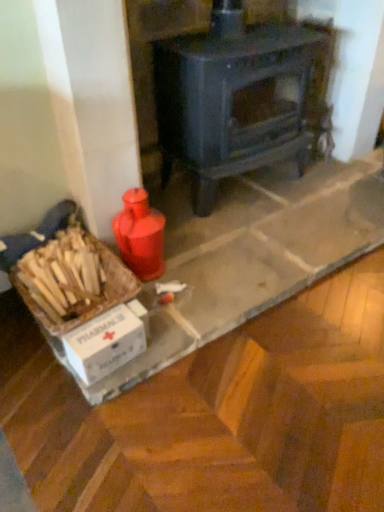
The width and height of the screenshot is (384, 512). I want to click on white cardboard box at lower left, so click(105, 343).

Identify the location of white cardboard box at lower left. The height and width of the screenshot is (512, 384). point(83,301).

Locate an element on the screen. matte black wood burning stove at center is located at coordinates [232, 98].

Where is `white cardboard box at lower left`? The height and width of the screenshot is (512, 384). white cardboard box at lower left is located at coordinates (105, 343).

Can you see white cardboard box at lower left touching matte black wood burning stove at center?

No, white cardboard box at lower left is not touching matte black wood burning stove at center.

From the image's perspective, relative to matte black wood burning stove at center, is white cardboard box at lower left above or below?

white cardboard box at lower left is below matte black wood burning stove at center.

Which object is further away from the camera, white cardboard box at lower left or matte black wood burning stove at center?

matte black wood burning stove at center is behind.

Considering the relative sizes of white cardboard box at lower left and matte black wood burning stove at center in the image provided, is white cardboard box at lower left wider than matte black wood burning stove at center?

In fact, white cardboard box at lower left might be narrower than matte black wood burning stove at center.

This screenshot has width=384, height=512. In the image, there is a white cardboard box at lower left. What are the coordinates of `cardboard box below it (from the image's perspective)` in the screenshot? It's located at (105, 343).

How different are the orientations of white cardboard box at lower left and white cardboard box at lower left in degrees?

They differ by 0.000429 degrees in their facing directions.

Is white cardboard box at lower left positioned far away from white cardboard box at lower left?

They are positioned close to each other.

Considering the relative sizes of white cardboard box at lower left and white cardboard box at lower left in the image provided, is white cardboard box at lower left wider than white cardboard box at lower left?

Yes, white cardboard box at lower left is wider than white cardboard box at lower left.

Which of these two, white cardboard box at lower left or white cardboard box at lower left, is bigger?

white cardboard box at lower left.

Would you say white cardboard box at lower left is part of white cardboard box at lower left's contents?

Definitely not — white cardboard box at lower left is not inside white cardboard box at lower left.

From a real-world perspective, is white cardboard box at lower left physically located above or below white cardboard box at lower left?

white cardboard box at lower left is below white cardboard box at lower left.

Is white cardboard box at lower left at the back of white cardboard box at lower left?

Yes, white cardboard box at lower left is at the back of white cardboard box at lower left.

Considering the points (164, 168) and (86, 303), which point is in front, point (164, 168) or point (86, 303)?

Point (86, 303)

From the picture: Is matte black wood burning stove at center not near white cardboard box at lower left?

No, matte black wood burning stove at center is not far away from white cardboard box at lower left.

Is matte black wood burning stove at center facing away from white cardboard box at lower left?

matte black wood burning stove at center is not turned away from white cardboard box at lower left.

Which of these two, matte black wood burning stove at center or white cardboard box at lower left, is thinner?

white cardboard box at lower left.

Between white cardboard box at lower left and matte black wood burning stove at center, which one has smaller size?

white cardboard box at lower left is smaller.

Could you tell me if white cardboard box at lower left is turned towards matte black wood burning stove at center?

No, white cardboard box at lower left is not facing towards matte black wood burning stove at center.

Based on the photo, is there a large distance between white cardboard box at lower left and matte black wood burning stove at center?

white cardboard box at lower left is near matte black wood burning stove at center, not far away.

From a real-world perspective, is white cardboard box at lower left on top of matte black wood burning stove at center?

No.

From the image's perspective, is matte black wood burning stove at center beneath white cardboard box at lower left?

No, from the image's perspective, matte black wood burning stove at center is not beneath white cardboard box at lower left.

Is the depth of matte black wood burning stove at center greater than that of white cardboard box at lower left?

That is True.

Locate an element on the screen. The width and height of the screenshot is (384, 512). wood burning stove behind the white cardboard box at lower left is located at coordinates (232, 98).

Can white cardboard box at lower left be found inside matte black wood burning stove at center?

Actually, white cardboard box at lower left is outside matte black wood burning stove at center.

This screenshot has width=384, height=512. Identify the location of wood burning stove on the right of white cardboard box at lower left. (232, 98).

Locate an element on the screen. This screenshot has height=512, width=384. cardboard box that appears below the white cardboard box at lower left (from the image's perspective) is located at coordinates (105, 343).

From the picture: From the image, which object appears to be farther from white cardboard box at lower left, matte black wood burning stove at center or white cardboard box at lower left?

matte black wood burning stove at center is positioned further to the anchor white cardboard box at lower left.

Based on their spatial positions, is white cardboard box at lower left or white cardboard box at lower left closer to matte black wood burning stove at center?

white cardboard box at lower left is closer to matte black wood burning stove at center.

Which object lies further to the anchor point matte black wood burning stove at center, white cardboard box at lower left or white cardboard box at lower left?

white cardboard box at lower left is positioned further to the anchor matte black wood burning stove at center.

When comparing their distances from white cardboard box at lower left, does white cardboard box at lower left or matte black wood burning stove at center seem further?

Among the two, matte black wood burning stove at center is located further to white cardboard box at lower left.

Looking at the image, which one is located further to white cardboard box at lower left, white cardboard box at lower left or matte black wood burning stove at center?

Among the two, matte black wood burning stove at center is located further to white cardboard box at lower left.

Considering their positions, is matte black wood burning stove at center positioned closer to white cardboard box at lower left than white cardboard box at lower left?

Among the two, white cardboard box at lower left is located nearer to white cardboard box at lower left.

Locate an element on the screen. This screenshot has height=512, width=384. box between matte black wood burning stove at center and white cardboard box at lower left from top to bottom is located at coordinates (83, 301).